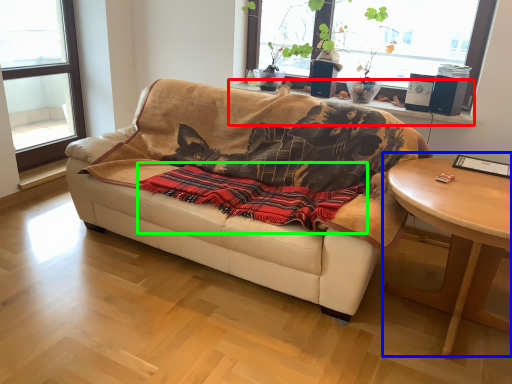
Question: Which object is the farthest from window sill (highlighted by a red box)? Choose among these: coffee table (highlighted by a blue box) or blanket (highlighted by a green box).

Choices:
 (A) coffee table
 (B) blanket

Answer: (B)